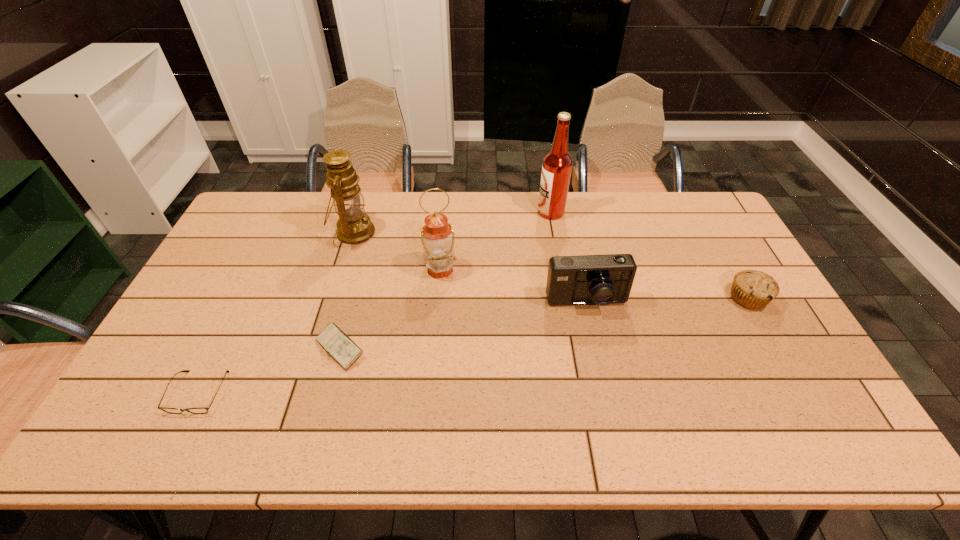
Image resolution: width=960 pixels, height=540 pixels. In order to click on empty location between the diary and the rightmost object in this screenshot , I will do `click(544, 323)`.

At what (x,y) coordinates should I click in order to perform the action: click on free spot between the leftmost object and the left oil lamp. Please return your answer as a coordinate pair (x, y). Looking at the image, I should click on (276, 312).

The width and height of the screenshot is (960, 540). Identify the location of free space between the left oil lamp and the tallest object. (452, 222).

Locate an element on the screen. vacant region between the right oil lamp and the diary is located at coordinates (391, 309).

This screenshot has width=960, height=540. In order to click on free space between the camera and the left oil lamp in this screenshot , I will do `click(469, 268)`.

Locate an element on the screen. The width and height of the screenshot is (960, 540). empty space between the right oil lamp and the second shortest object is located at coordinates (391, 309).

What are the coordinates of `free space between the fourth tallest object and the shortest object` in the screenshot? It's located at (393, 348).

At what (x,y) coordinates should I click in order to perform the action: click on blank region between the camera and the left oil lamp. Please return your answer as a coordinate pair (x, y). This screenshot has height=540, width=960. Looking at the image, I should click on (469, 268).

Image resolution: width=960 pixels, height=540 pixels. I want to click on vacant area that lies between the camera and the farther oil lamp, so click(x=469, y=268).

Locate an element on the screen. The height and width of the screenshot is (540, 960). object that stands as the sixth closest to the diary is located at coordinates (752, 289).